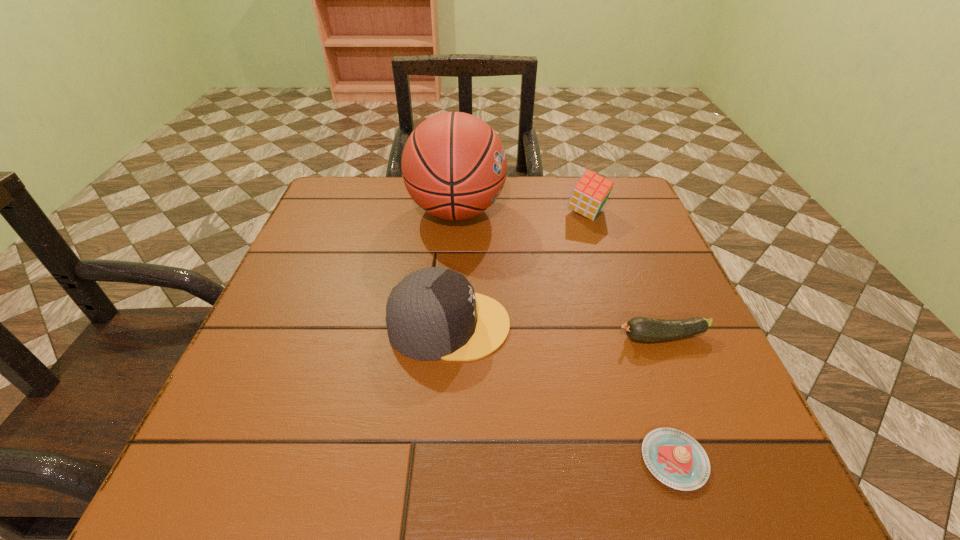
This screenshot has width=960, height=540. What are the coordinates of `vacant space in between the fourth tallest object and the cap` in the screenshot? It's located at (556, 331).

In order to click on unoccupied area between the cap and the basketball in this screenshot , I will do `click(453, 268)`.

Where is `vacant region between the cap and the second shortest object`? This screenshot has width=960, height=540. vacant region between the cap and the second shortest object is located at coordinates (556, 331).

Find the location of a particular element. This screenshot has width=960, height=540. free spot between the cap and the basketball is located at coordinates (453, 268).

In order to click on the second closest object to the tallest object in this screenshot , I will do `click(433, 313)`.

Image resolution: width=960 pixels, height=540 pixels. Find the location of `the fourth closest object to the cube`. the fourth closest object to the cube is located at coordinates (675, 458).

Find the location of a particular element. vacant position in the image that satisfies the following two spatial constraints: 1. on the logo side of the cube; 2. on the right side of the tallest object is located at coordinates (456, 213).

At what (x,y) coordinates should I click in order to perform the action: click on free space that satisfies the following two spatial constraints: 1. on the logo side of the tallest object; 2. on the back side of the nearest object. Please return your answer as a coordinate pair (x, y). Looking at the image, I should click on (439, 460).

Locate an element on the screen. The image size is (960, 540). free space that satisfies the following two spatial constraints: 1. on the front-facing side of the cap; 2. on the right side of the nearest object is located at coordinates (440, 460).

Find the location of a particular element. The width and height of the screenshot is (960, 540). free spot that satisfies the following two spatial constraints: 1. on the logo side of the tallest object; 2. on the back side of the shortest object is located at coordinates coord(439,460).